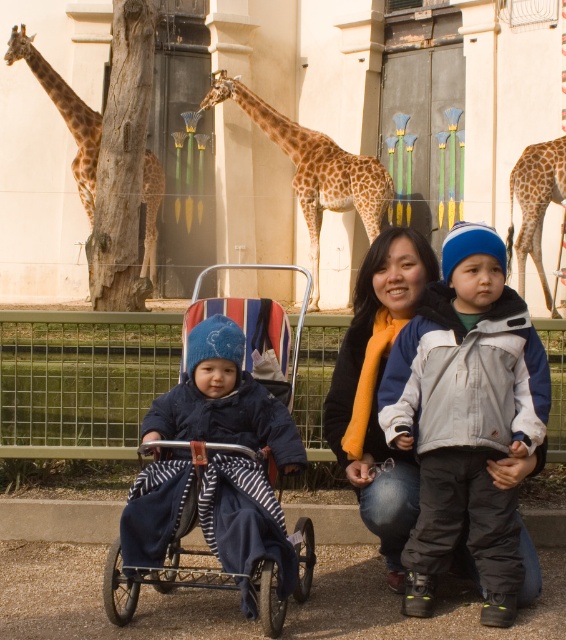
You are a zookeeper who needs to feed the giraffes. The spotted fur giraffe at center and the spotted fur giraffe at left are both in the enclosure. Which giraffe should you feed first if you want to start with the larger one?

The spotted fur giraffe at center is bigger than the spotted fur giraffe at left, so you should feed the spotted fur giraffe at center first.

From the picture: You are a zoo visitor trying to take a photo of the giraffes. You have the gray fleece jacket at center and the dark blue fabric baby carriage at left in your way. Which object is closer to you, blocking your view more?

The gray fleece jacket at center is closer to you than the dark blue fabric baby carriage at left, so it is blocking your view more.

Where is the gray fleece jacket at center located in the image?

The gray fleece jacket at center is located at point (465,419) in the image.